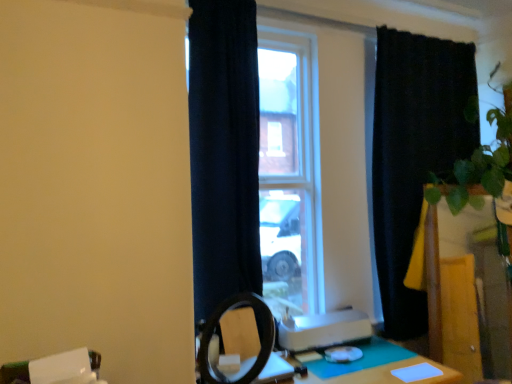
Question: From a real-world perspective, is navy blue curtain at center, positioned as the 2th curtain in right-to-left order, physically below green matte plant at right?

Choices:
 (A) no
 (B) yes

Answer: (A)

Question: Is navy blue curtain at center, the second curtain positioned from the back, shorter than green matte plant at right?

Choices:
 (A) no
 (B) yes

Answer: (A)

Question: Does navy blue curtain at center, the first curtain when ordered from left to right, lie behind green matte plant at right?

Choices:
 (A) no
 (B) yes

Answer: (A)

Question: Is navy blue curtain at center, the first curtain when ordered from left to right, positioned before green matte plant at right?

Choices:
 (A) yes
 (B) no

Answer: (A)

Question: Is navy blue curtain at center, positioned as the 2th curtain in right-to-left order, facing towards green matte plant at right?

Choices:
 (A) yes
 (B) no

Answer: (B)

Question: Can we say navy blue curtain at center, positioned as the 2th curtain in right-to-left order, lies outside green matte plant at right?

Choices:
 (A) no
 (B) yes

Answer: (B)

Question: Considering the relative sizes of green felt table at lower right and green matte plant at right in the image provided, is green felt table at lower right smaller than green matte plant at right?

Choices:
 (A) yes
 (B) no

Answer: (B)

Question: Considering the relative sizes of green felt table at lower right and green matte plant at right in the image provided, is green felt table at lower right wider than green matte plant at right?

Choices:
 (A) no
 (B) yes

Answer: (B)

Question: Is green matte plant at right located within green felt table at lower right?

Choices:
 (A) no
 (B) yes

Answer: (A)

Question: Considering the relative positions of green felt table at lower right and green matte plant at right in the image provided, is green felt table at lower right to the left of green matte plant at right from the viewer's perspective?

Choices:
 (A) no
 (B) yes

Answer: (B)

Question: From a real-world perspective, is green felt table at lower right physically above green matte plant at right?

Choices:
 (A) yes
 (B) no

Answer: (B)

Question: Is green felt table at lower right bigger than green matte plant at right?

Choices:
 (A) yes
 (B) no

Answer: (A)

Question: From the image's perspective, would you say green felt table at lower right is shown under navy blue curtain at center, the second curtain positioned from the back?

Choices:
 (A) no
 (B) yes

Answer: (B)